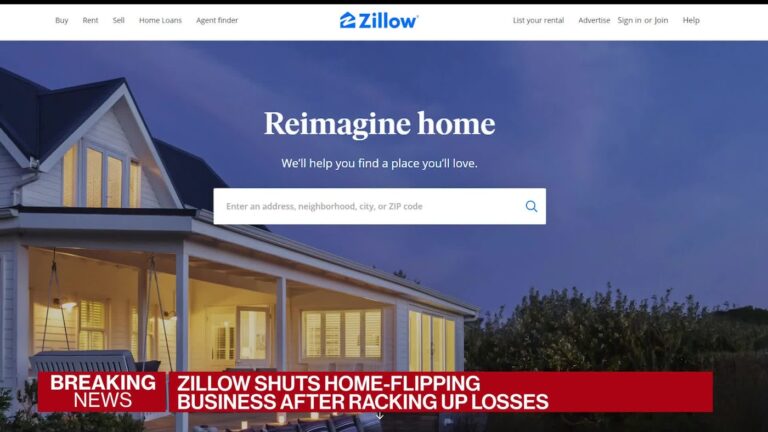
I want to click on window with horizontal area, so click(94, 317).